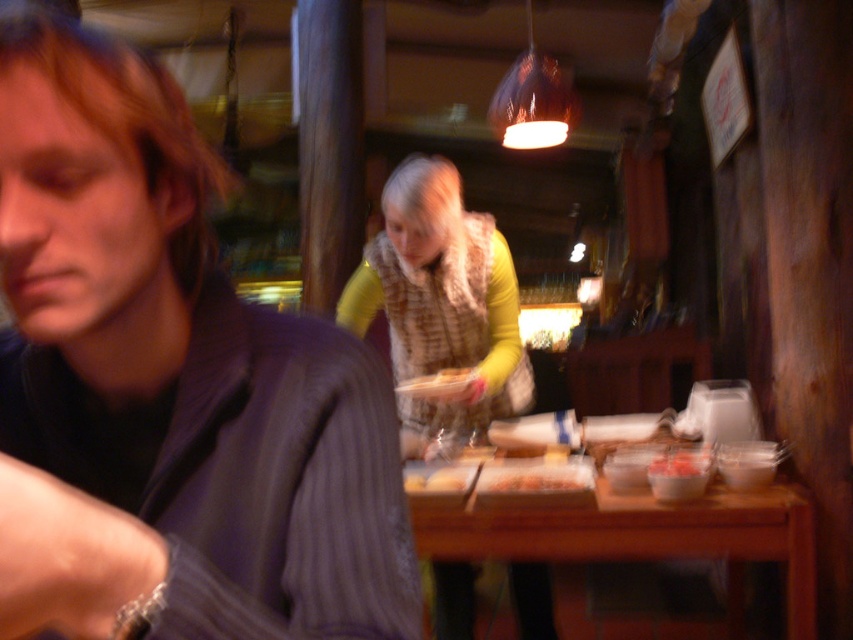
Does dark gray striped shirt at left appear under smooth pinkish-red paste at lower center?

Actually, dark gray striped shirt at left is above smooth pinkish-red paste at lower center.

Is point (358, 436) positioned after point (657, 472)?

That is False.

Locate an element on the screen. This screenshot has height=640, width=853. dark gray striped shirt at left is located at coordinates pos(169,387).

How far apart are smooth white bread at center and smooth pinkish-red paste at lower center?

A distance of 51.92 centimeters exists between smooth white bread at center and smooth pinkish-red paste at lower center.

Between smooth white bread at center and smooth pinkish-red paste at lower center, which one has less height?

smooth pinkish-red paste at lower center

Image resolution: width=853 pixels, height=640 pixels. What do you see at coordinates (439, 384) in the screenshot? I see `smooth white bread at center` at bounding box center [439, 384].

At what (x,y) coordinates should I click in order to perform the action: click on smooth white bread at center. Please return your answer as a coordinate pair (x, y). This screenshot has height=640, width=853. Looking at the image, I should click on (439, 384).

Which is below, wooden table at lower right or smooth white bread at center?

Positioned lower is wooden table at lower right.

Does wooden table at lower right have a lesser height compared to smooth white bread at center?

In fact, wooden table at lower right may be taller than smooth white bread at center.

Who is more distant from viewer, (x=601, y=508) or (x=421, y=392)?

Point (x=421, y=392)

I want to click on wooden table at lower right, so click(x=639, y=534).